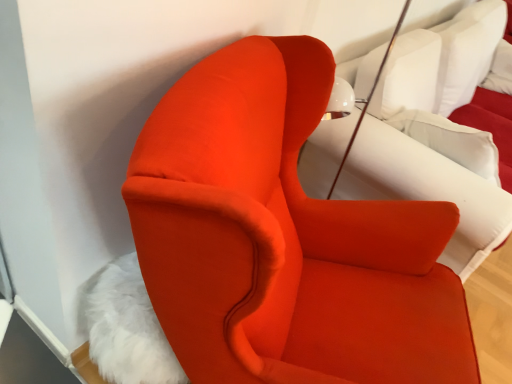
Question: From a real-world perspective, is white soft pillow at upper right on white fluffy rug at lower left?

Choices:
 (A) yes
 (B) no

Answer: (A)

Question: Is white soft pillow at upper right turned away from white fluffy rug at lower left?

Choices:
 (A) no
 (B) yes

Answer: (A)

Question: Does white soft pillow at upper right have a smaller size compared to white fluffy rug at lower left?

Choices:
 (A) yes
 (B) no

Answer: (B)

Question: Considering the relative positions of white soft pillow at upper right and white fluffy rug at lower left in the image provided, is white soft pillow at upper right to the left of white fluffy rug at lower left from the viewer's perspective?

Choices:
 (A) yes
 (B) no

Answer: (B)

Question: Can you confirm if white soft pillow at upper right is taller than white fluffy rug at lower left?

Choices:
 (A) yes
 (B) no

Answer: (A)

Question: Looking at their shapes, would you say velvet white bed at center is wider or thinner than white fluffy rug at lower left?

Choices:
 (A) thin
 (B) wide

Answer: (B)

Question: Considering the relative positions of velvet white bed at center and white fluffy rug at lower left in the image provided, is velvet white bed at center to the left or to the right of white fluffy rug at lower left?

Choices:
 (A) left
 (B) right

Answer: (B)

Question: Choose the correct answer: Is velvet white bed at center inside white fluffy rug at lower left or outside it?

Choices:
 (A) outside
 (B) inside

Answer: (A)

Question: From the image's perspective, is velvet white bed at center above or below white fluffy rug at lower left?

Choices:
 (A) below
 (B) above

Answer: (B)

Question: From the image's perspective, is white soft pillow at upper right above or below matte orange armchair at center?

Choices:
 (A) below
 (B) above

Answer: (B)

Question: Is white soft pillow at upper right wider or thinner than matte orange armchair at center?

Choices:
 (A) thin
 (B) wide

Answer: (A)

Question: Is white soft pillow at upper right situated inside matte orange armchair at center or outside?

Choices:
 (A) inside
 (B) outside

Answer: (B)

Question: In terms of height, does white soft pillow at upper right look taller or shorter compared to matte orange armchair at center?

Choices:
 (A) tall
 (B) short

Answer: (B)

Question: From a real-world perspective, is white fluffy rug at lower left physically located above or below white soft pillow at upper right?

Choices:
 (A) above
 (B) below

Answer: (B)

Question: From the image's perspective, relative to white soft pillow at upper right, is white fluffy rug at lower left above or below?

Choices:
 (A) below
 (B) above

Answer: (A)